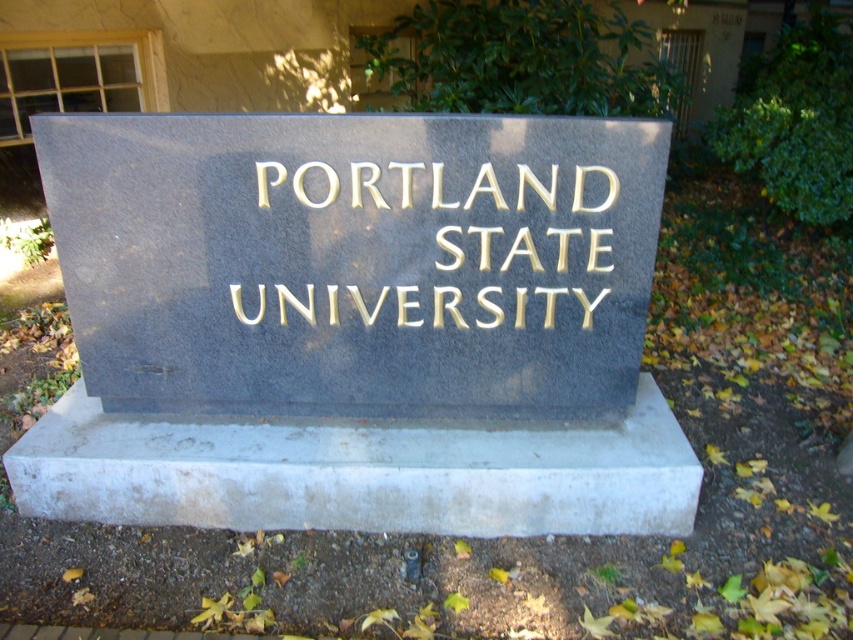
Question: Which object is closer to the camera taking this photo?

Choices:
 (A) black granite sign at center
 (B) gold embossed text at center
 (C) gray concrete base at center

Answer: (A)

Question: Which object is positioned farthest from the gray concrete base at center?

Choices:
 (A) black granite sign at center
 (B) gold embossed text at center

Answer: (B)

Question: Which point appears farthest from the camera in this image?

Choices:
 (A) (502, 225)
 (B) (519, 129)

Answer: (A)

Question: Can you confirm if gray concrete base at center is positioned above gold embossed text at center?

Choices:
 (A) yes
 (B) no

Answer: (B)

Question: Is black granite sign at center positioned behind gold embossed text at center?

Choices:
 (A) yes
 (B) no

Answer: (B)

Question: Does black granite sign at center appear under gold embossed text at center?

Choices:
 (A) no
 (B) yes

Answer: (B)